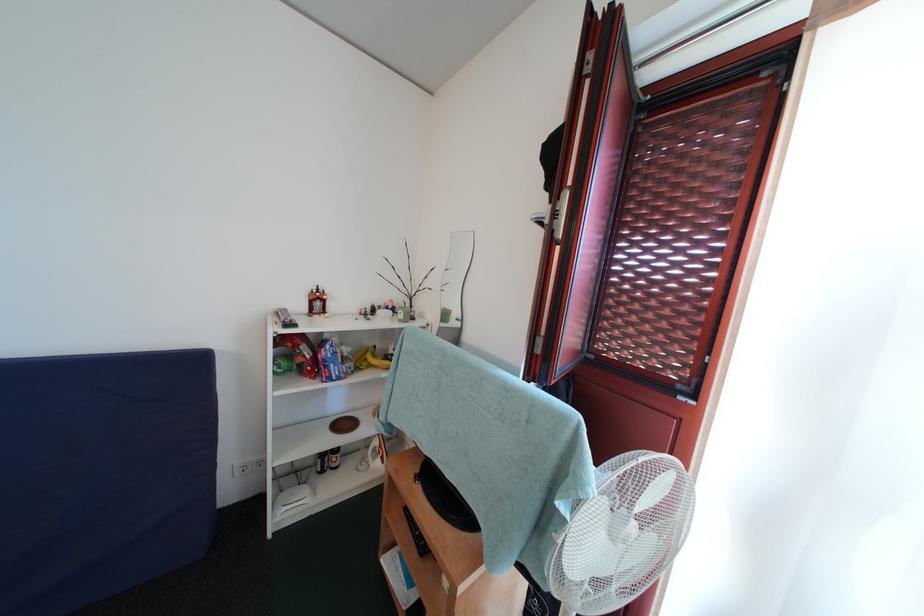
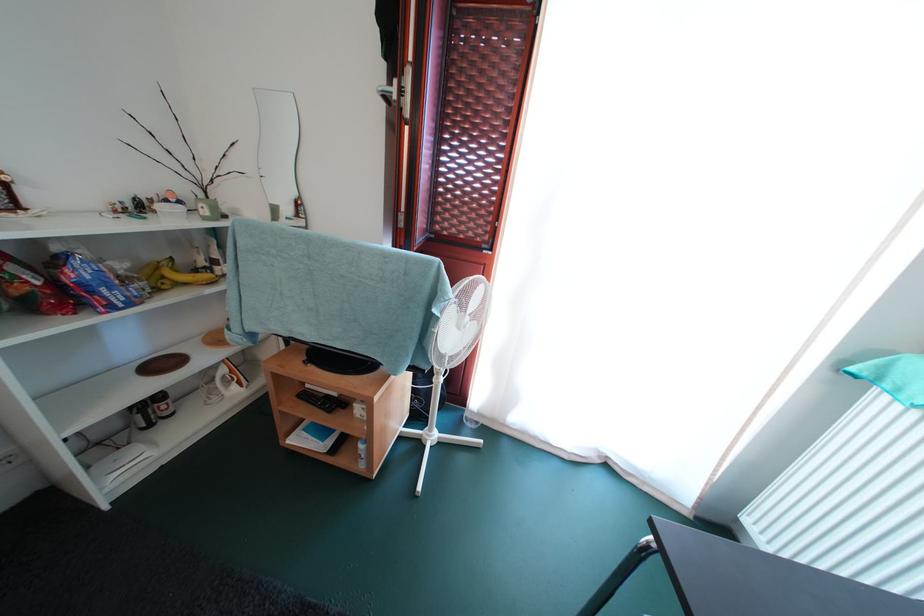
Locate, in the second image, the point that corresponds to point (311, 361) in the first image.

(34, 286)